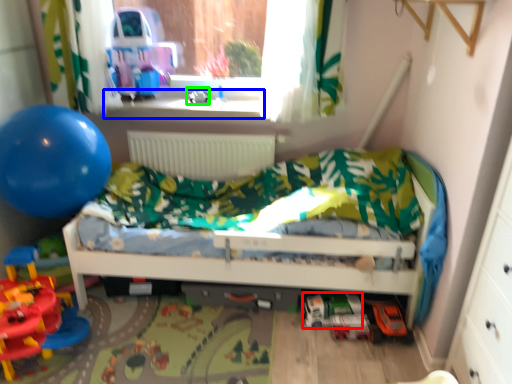
Question: Based on their relative distances, which object is farther from toy (highlighted by a red box)? Choose from window sill (highlighted by a blue box) and toy (highlighted by a green box).

Choices:
 (A) window sill
 (B) toy

Answer: (B)